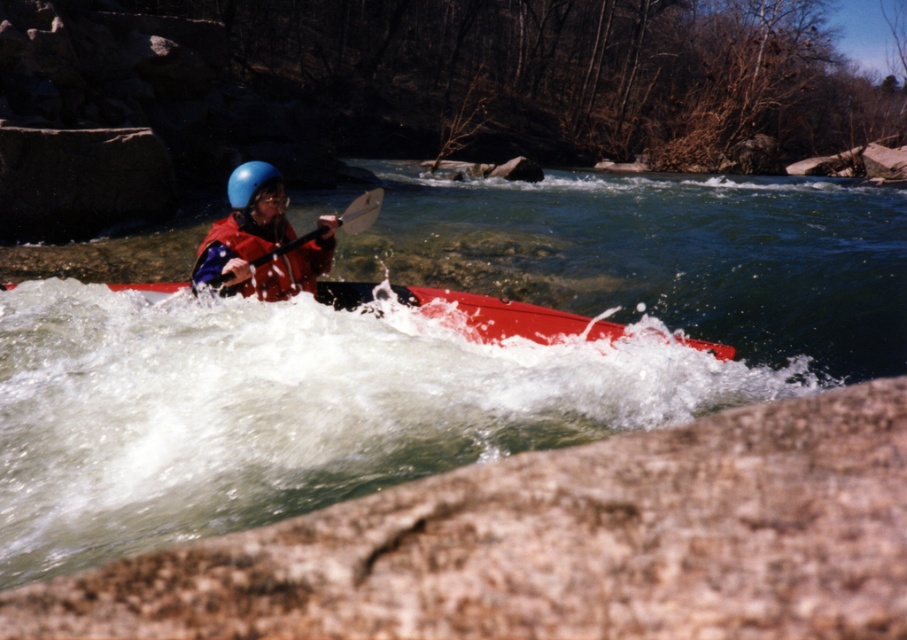
You are a photographer trying to capture the kayaker in the image. You want to ensure the black plastic paddle at center is visible in your shot. Where should you position your camera relative to the point marked at point (361, 211)?

The black plastic paddle at center is located at point (361, 211), so position your camera directly at that point to ensure the paddle is visible.

You are a photographer trying to capture the kayaker in the image. You want to focus on the point at the lower part of the kayak. Which point, point at coordinates (327, 230) or point at coordinates (239, 205), is closer to the camera and should be chosen for better focus?

Point at coordinates (239, 205) is closer to the camera than point at coordinates (327, 230), so you should choose point at coordinates (239, 205) for better focus.

Based on the scene description, where is the smooth water at center located in the image?

The smooth water at center is located at point coordinates of (x=428, y=353).